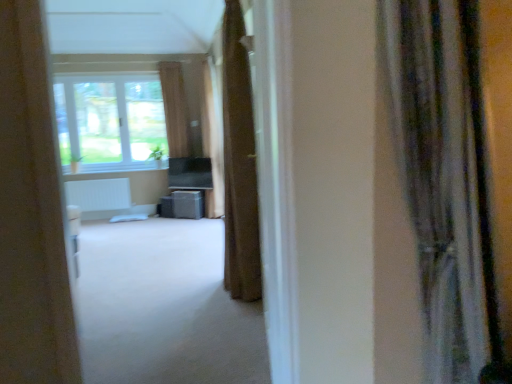
What do you see at coordinates (239, 164) in the screenshot?
I see `brown fabric curtain at center, which is the second curtain from right to left` at bounding box center [239, 164].

Describe the element at coordinates (212, 141) in the screenshot. I see `brown fabric curtain at center, which is the 2th curtain from left to right` at that location.

Find the location of a particular element. Image resolution: width=512 pixels, height=384 pixels. brown fabric curtain at center, placed as the second curtain when sorted from front to back is located at coordinates (239, 164).

Considering the sizes of objects white carpet at center and silky gray curtain at right, placed as the 4th curtain when sorted from left to right, in the image provided, who is taller, white carpet at center or silky gray curtain at right, placed as the 4th curtain when sorted from left to right,?

Standing taller between the two is silky gray curtain at right, placed as the 4th curtain when sorted from left to right.

From the image's perspective, is white carpet at center over silky gray curtain at right, the first curtain from the front?

No.

Which object is wider, white carpet at center or silky gray curtain at right, placed as the 4th curtain when sorted from left to right?

Wider between the two is white carpet at center.

Considering the relative positions of white carpet at center and silky gray curtain at right, the first curtain in the right-to-left sequence, in the image provided, is white carpet at center to the left of silky gray curtain at right, the first curtain in the right-to-left sequence, from the viewer's perspective?

Yes, white carpet at center is to the left of silky gray curtain at right, the first curtain in the right-to-left sequence.

Based on the photo, is silky gray curtain at right, the first curtain in the right-to-left sequence, bigger or smaller than brown fabric curtain at center, which is the second curtain from right to left?

In the image, silky gray curtain at right, the first curtain in the right-to-left sequence, appears to be smaller than brown fabric curtain at center, which is the second curtain from right to left.

Can you confirm if silky gray curtain at right, placed as the 4th curtain when sorted from left to right, is taller than brown fabric curtain at center, the 3th curtain from the back?

No, silky gray curtain at right, placed as the 4th curtain when sorted from left to right, is not taller than brown fabric curtain at center, the 3th curtain from the back.

From a real-world perspective, which object stands above the other?

brown fabric curtain at center, the 3th curtain viewed from the left, is physically above.

Would you say silky gray curtain at right, the first curtain in the right-to-left sequence, is inside or outside brown fabric curtain at center, placed as the second curtain when sorted from front to back?

The correct answer is: outside.

In the scene shown: Does matte gray speaker at center touch white carpet at center?

There is a gap between matte gray speaker at center and white carpet at center.

Based on the photo, how different are the orientations of matte gray speaker at center and white carpet at center in degrees?

The facing directions of matte gray speaker at center and white carpet at center are 18.2 degrees apart.

Looking at this image, from the image's perspective, relative to white carpet at center, is matte gray speaker at center above or below?

matte gray speaker at center is situated higher than white carpet at center in the image.

Locate an element on the screen. corridor to the left of matte gray speaker at center is located at coordinates (164, 307).

Considering the sizes of objects brown fabric curtain at center, placed as the second curtain when sorted from front to back, and brown fabric curtain at center, which is the 4th curtain from right to left, in the image provided, who is bigger, brown fabric curtain at center, placed as the second curtain when sorted from front to back, or brown fabric curtain at center, which is the 4th curtain from right to left,?

With larger size is brown fabric curtain at center, placed as the second curtain when sorted from front to back.

Is brown fabric curtain at center, placed as the second curtain when sorted from front to back, facing towards brown fabric curtain at center, which appears as the 1th curtain when viewed from the left?

No, brown fabric curtain at center, placed as the second curtain when sorted from front to back, is not oriented towards brown fabric curtain at center, which appears as the 1th curtain when viewed from the left.

Is brown fabric curtain at center, arranged as the first curtain when viewed from the back, located within brown fabric curtain at center, which is the second curtain from right to left?

Definitely not — brown fabric curtain at center, arranged as the first curtain when viewed from the back, is not inside brown fabric curtain at center, which is the second curtain from right to left.

Is point (233, 271) positioned after point (170, 79)?

No.

In terms of width, does white carpet at center look wider or thinner when compared to brown fabric curtain at center, which appears as the fourth curtain when viewed from the front?

Clearly, white carpet at center has more width compared to brown fabric curtain at center, which appears as the fourth curtain when viewed from the front.

Can we say white carpet at center lies outside brown fabric curtain at center, arranged as the first curtain when viewed from the back?

Absolutely, white carpet at center is external to brown fabric curtain at center, arranged as the first curtain when viewed from the back.

Which object is more forward, white carpet at center or brown fabric curtain at center, which is the 4th curtain from right to left?

white carpet at center is closer to the camera.

Is white carpet at center turned away from brown fabric curtain at center, arranged as the first curtain when viewed from the back?

No, white carpet at center is not facing the opposite direction of brown fabric curtain at center, arranged as the first curtain when viewed from the back.

From the brown fabric curtain at center, the 3th curtain viewed from the left, count 1st curtains backward and point to it. Please provide its 2D coordinates.

[(212, 141)]

Considering the positions of objects brown fabric curtain at center, acting as the third curtain starting from the right, and brown fabric curtain at center, placed as the second curtain when sorted from front to back, in the image provided, who is more to the right, brown fabric curtain at center, acting as the third curtain starting from the right, or brown fabric curtain at center, placed as the second curtain when sorted from front to back,?

brown fabric curtain at center, placed as the second curtain when sorted from front to back, is more to the right.

Is brown fabric curtain at center, which appears as the 2th curtain when viewed from the back, with brown fabric curtain at center, which is the second curtain from right to left?

No, brown fabric curtain at center, which appears as the 2th curtain when viewed from the back, is not touching brown fabric curtain at center, which is the second curtain from right to left.

How different are the orientations of brown fabric curtain at center, placed as the third curtain when sorted from front to back, and brown fabric curtain at center, the 3th curtain from the back, in degrees?

The angular difference between brown fabric curtain at center, placed as the third curtain when sorted from front to back, and brown fabric curtain at center, the 3th curtain from the back, is 0.00274 degrees.

Can you confirm if matte gray speaker at center is bigger than brown fabric curtain at center, the 3th curtain from the back?

No.

Is matte gray speaker at center in contact with brown fabric curtain at center, the 3th curtain viewed from the left?

No, matte gray speaker at center is not making contact with brown fabric curtain at center, the 3th curtain viewed from the left.

Is matte gray speaker at center taller than brown fabric curtain at center, the 3th curtain from the back?

Incorrect, the height of matte gray speaker at center is not larger of that of brown fabric curtain at center, the 3th curtain from the back.

Find the location of `furniture on the left of brown fabric curtain at center, placed as the second curtain when sorted from front to back`. furniture on the left of brown fabric curtain at center, placed as the second curtain when sorted from front to back is located at coordinates (181, 205).

You are a GUI agent. You are given a task and a screenshot of the screen. Output one action in this format:
    pyautogui.click(x=<x>, y=<y>)
    Task: Click on the curtain that is the 3rd object to the right of the white carpet at center, starting at the anchor
    Image resolution: width=512 pixels, height=384 pixels.
    Given the screenshot: What is the action you would take?
    pyautogui.click(x=446, y=183)

Where is `the 1st curtain behind the silky gray curtain at right, the first curtain in the right-to-left sequence`? The image size is (512, 384). the 1st curtain behind the silky gray curtain at right, the first curtain in the right-to-left sequence is located at coordinates click(239, 164).

From the image, which object appears to be farther from brown fabric curtain at center, which appears as the 2th curtain when viewed from the back, brown fabric curtain at center, which is the second curtain from right to left, or white carpet at center?

brown fabric curtain at center, which is the second curtain from right to left, lies further to brown fabric curtain at center, which appears as the 2th curtain when viewed from the back, than the other object.

Looking at the image, which one is located closer to silky gray curtain at right, the first curtain in the right-to-left sequence, brown fabric curtain at center, which appears as the fourth curtain when viewed from the front, or brown fabric curtain at center, which appears as the 2th curtain when viewed from the back?

brown fabric curtain at center, which appears as the 2th curtain when viewed from the back.

When comparing their distances from brown fabric curtain at center, which is the second curtain from right to left, does brown fabric curtain at center, placed as the third curtain when sorted from front to back, or white carpet at center seem closer?

white carpet at center is positioned closer to the anchor brown fabric curtain at center, which is the second curtain from right to left.

When comparing their distances from brown fabric curtain at center, which is the 2th curtain from left to right, does brown fabric curtain at center, which appears as the 1th curtain when viewed from the left, or white carpet at center seem closer?

Based on the image, brown fabric curtain at center, which appears as the 1th curtain when viewed from the left, appears to be nearer to brown fabric curtain at center, which is the 2th curtain from left to right.

When comparing their distances from brown fabric curtain at center, the 3th curtain from the back, does brown fabric curtain at center, which is the 2th curtain from left to right, or brown fabric curtain at center, which appears as the 1th curtain when viewed from the left, seem further?

Based on the image, brown fabric curtain at center, which appears as the 1th curtain when viewed from the left, appears to be further to brown fabric curtain at center, the 3th curtain from the back.

Based on their spatial positions, is brown fabric curtain at center, acting as the third curtain starting from the right, or matte gray speaker at center further from brown fabric curtain at center, which appears as the fourth curtain when viewed from the front?

matte gray speaker at center lies further to brown fabric curtain at center, which appears as the fourth curtain when viewed from the front, than the other object.

Which object lies nearer to the anchor point brown fabric curtain at center, the 3th curtain viewed from the left, white carpet at center or brown fabric curtain at center, arranged as the first curtain when viewed from the back?

white carpet at center is closer to brown fabric curtain at center, the 3th curtain viewed from the left.

Estimate the real-world distances between objects in this image. Which object is closer to white carpet at center, matte gray speaker at center or brown fabric curtain at center, which is the 2th curtain from left to right?

brown fabric curtain at center, which is the 2th curtain from left to right, lies closer to white carpet at center than the other object.

Find the location of a particular element. The width and height of the screenshot is (512, 384). curtain between brown fabric curtain at center, the 3th curtain viewed from the left, and brown fabric curtain at center, which appears as the fourth curtain when viewed from the front, in the front-back direction is located at coordinates (212, 141).

Locate an element on the screen. The image size is (512, 384). corridor positioned between silky gray curtain at right, placed as the 4th curtain when sorted from left to right, and brown fabric curtain at center, which is the 2th curtain from left to right, from near to far is located at coordinates (164, 307).

Find the location of a particular element. furniture located between silky gray curtain at right, placed as the 4th curtain when sorted from left to right, and brown fabric curtain at center, which is the 4th curtain from right to left, in the depth direction is located at coordinates (181, 205).

Locate an element on the screen. Image resolution: width=512 pixels, height=384 pixels. curtain between white carpet at center and brown fabric curtain at center, which is the 2th curtain from left to right, along the z-axis is located at coordinates (239, 164).